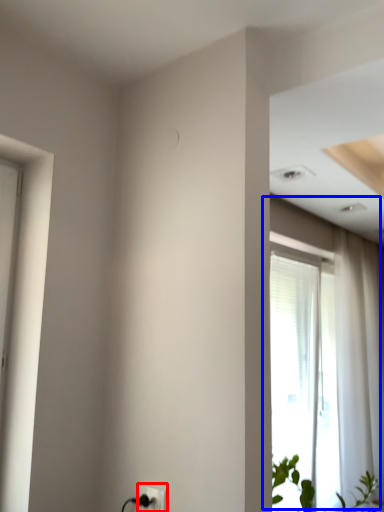
Question: Which object is closer to the camera taking this photo, electric outlet (highlighted by a red box) or window (highlighted by a blue box)?

Choices:
 (A) electric outlet
 (B) window

Answer: (A)